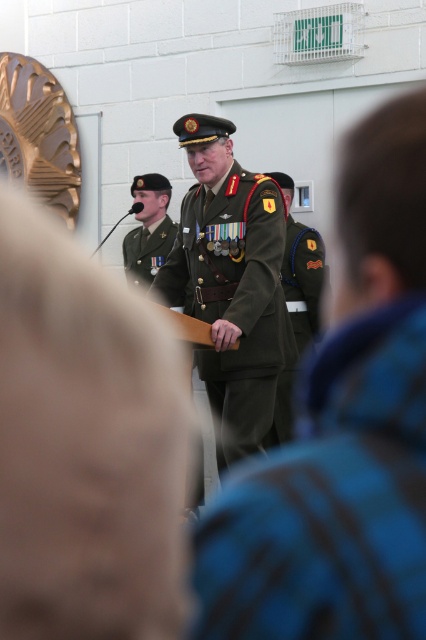
You are attending a military ceremony and see two uniforms at the center of the scene. Which one is lower in position between the green fabric uniform at center and the olive green uniform at center?

The green fabric uniform at center is positioned under the olive green uniform at center, so the green fabric uniform at center is lower in position.